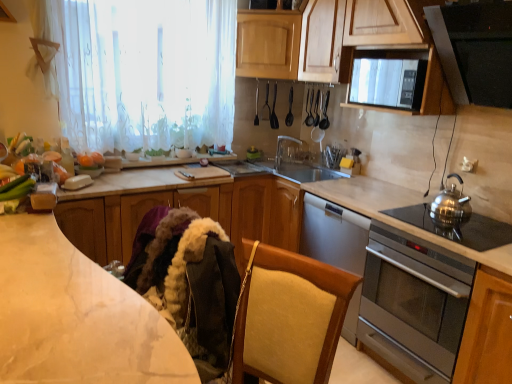
The width and height of the screenshot is (512, 384). What do you see at coordinates (487, 331) in the screenshot? I see `wooden cabinet at lower right, marked as the 4th cabinetry in a top-to-bottom arrangement` at bounding box center [487, 331].

Measure the distance between point (471, 352) and camera.

Point (471, 352) is 6.19 feet from camera.

What do you see at coordinates (413, 303) in the screenshot?
I see `stainless steel oven at right` at bounding box center [413, 303].

Identify the location of stainless steel oven at right. (413, 303).

The height and width of the screenshot is (384, 512). What do you see at coordinates (268, 44) in the screenshot? I see `wooden cabinet at upper center, the fourth cabinetry ordered from the bottom` at bounding box center [268, 44].

What do you see at coordinates (290, 42) in the screenshot? The height and width of the screenshot is (384, 512). I see `wooden cabinet at upper center, the second cabinetry when ordered from top to bottom` at bounding box center [290, 42].

Locate an element on the screen. This screenshot has height=384, width=512. wooden cabinet at lower right, the first cabinetry from the bottom is located at coordinates (487, 331).

Locate an element on the screen. The image size is (512, 384). the 2nd cabinetry behind the orange matte pumpkin at upper left, starting your count from the anchor is located at coordinates (268, 44).

How different are the orientations of wooden cabinet at upper center, arranged as the 1th cabinetry when viewed from the top, and orange matte pumpkin at upper left in degrees?

50.2 degrees.

Could you tell me if wooden cabinet at upper center, the fourth cabinetry ordered from the bottom, is turned towards orange matte pumpkin at upper left?

No, wooden cabinet at upper center, the fourth cabinetry ordered from the bottom, is not turned towards orange matte pumpkin at upper left.

Is wooden cabinet at upper center, the fourth cabinetry ordered from the bottom, next to orange matte pumpkin at upper left and touching it?

No.

The image size is (512, 384). Find the location of `chair that appears in front of the orange matte pumpkin at upper left`. chair that appears in front of the orange matte pumpkin at upper left is located at coordinates (288, 317).

Does velvet beige chair at lower center have a lesser height compared to orange matte pumpkin at upper left?

Incorrect, the height of velvet beige chair at lower center does not fall short of that of orange matte pumpkin at upper left.

Does velvet beige chair at lower center appear on the right side of orange matte pumpkin at upper left?

Yes, velvet beige chair at lower center is to the right of orange matte pumpkin at upper left.

Considering their positions, is velvet beige chair at lower center located in front of or behind orange matte pumpkin at upper left?

Clearly, velvet beige chair at lower center is in front of orange matte pumpkin at upper left.

Can you confirm if stainless steel oven at right is smaller than black plastic spoon at upper center, acting as the second appliance starting from the left?

No, stainless steel oven at right is not smaller than black plastic spoon at upper center, acting as the second appliance starting from the left.

Which point is more distant from viewer, (x=435, y=309) or (x=290, y=125)?

The point (x=290, y=125) is farther.

Is stainless steel oven at right positioned beyond the bounds of black plastic spoon at upper center, acting as the second appliance starting from the left?

That's correct, stainless steel oven at right is outside of black plastic spoon at upper center, acting as the second appliance starting from the left.

In the scene shown: Which object is further away from the camera taking this photo, stainless steel oven at right or black plastic spoon at upper center, which is counted as the 1th appliance, starting from the right?

black plastic spoon at upper center, which is counted as the 1th appliance, starting from the right, is behind.

From the image's perspective, who appears lower, metallic silver spoon at upper center, the 2th appliance from the right, or white sheer curtain at upper left?

metallic silver spoon at upper center, the 2th appliance from the right, appears lower in the image.

Can you confirm if metallic silver spoon at upper center, positioned as the 1th appliance in left-to-right order, is thinner than white sheer curtain at upper left?

Yes.

Is white sheer curtain at upper left positioned behind stainless steel kettle at right?

Yes, white sheer curtain at upper left is further from the camera.

Does white sheer curtain at upper left have a greater width compared to stainless steel kettle at right?

No, white sheer curtain at upper left is not wider than stainless steel kettle at right.

Is white sheer curtain at upper left situated inside stainless steel kettle at right or outside?

white sheer curtain at upper left is not inside stainless steel kettle at right, it's outside.

Considering the positions of point (202, 55) and point (455, 211), is point (202, 55) closer or farther from the camera than point (455, 211)?

Point (202, 55) is positioned farther from the camera compared to point (455, 211).

From the image's perspective, relative to clear plastic tap at center, is marble at left, marked as the first countertop in a front-to-back arrangement, above or below?

Based on their image positions, marble at left, marked as the first countertop in a front-to-back arrangement, is located beneath clear plastic tap at center.

Do you think marble at left, marked as the first countertop in a front-to-back arrangement, is within clear plastic tap at center, or outside of it?

marble at left, marked as the first countertop in a front-to-back arrangement, is located beyond the bounds of clear plastic tap at center.

Would you consider marble at left, marked as the first countertop in a front-to-back arrangement, to be distant from clear plastic tap at center?

Absolutely, marble at left, marked as the first countertop in a front-to-back arrangement, is distant from clear plastic tap at center.

Does marble at left, marked as the first countertop in a front-to-back arrangement, lie in front of clear plastic tap at center?

Yes, it is.

How many degrees apart are the facing directions of wooden cabinet at lower right, the first cabinetry from the bottom, and satin silver gas stove at right?

0.859 degrees.

Does point (479, 294) appear closer or farther from the camera than point (497, 239)?

Clearly, point (479, 294) is closer to the camera than point (497, 239).

Is wooden cabinet at lower right, the first cabinetry from the bottom, located outside satin silver gas stove at right?

Yes.

Does wooden cabinet at lower right, the first cabinetry from the bottom, come behind satin silver gas stove at right?

That is False.

Find the location of a particular element. the 1st cabinetry to the right of the orange matte pumpkin at upper left, counting from the anchor's position is located at coordinates (268, 44).

You are a GUI agent. You are given a task and a screenshot of the screen. Output one action in this format:
    pyautogui.click(x=<x>, y=<y>)
    Task: Click on the food above the velvet beige chair at lower center (from a real-world perspective)
    This screenshot has height=384, width=512.
    Given the screenshot: What is the action you would take?
    pyautogui.click(x=90, y=160)

Which object lies further to the anchor point clear plastic tap at center, marble at left, which is the second countertop in back-to-front order, or satin silver gas stove at right?

marble at left, which is the second countertop in back-to-front order, is further to clear plastic tap at center.

When comparing their distances from wooden cabinet at lower right, the first cabinetry from the bottom, does wooden cabinet at upper center, the second cabinetry when ordered from top to bottom, or metallic silver spoon at upper center, positioned as the 1th appliance in left-to-right order, seem further?

metallic silver spoon at upper center, positioned as the 1th appliance in left-to-right order, is further to wooden cabinet at lower right, the first cabinetry from the bottom.

Which object lies further to the anchor point metallic silver spoon at upper center, the 2th appliance from the right, orange matte pumpkin at upper left or wooden cabinet at upper center, arranged as the 1th cabinetry when viewed from the top?

Among the two, orange matte pumpkin at upper left is located further to metallic silver spoon at upper center, the 2th appliance from the right.

Looking at the image, which one is located further to clear plastic tap at center, wooden cabinet at upper center, the fourth cabinetry ordered from the bottom, or black plastic spoon at upper center, acting as the second appliance starting from the left?

The object further to clear plastic tap at center is wooden cabinet at upper center, the fourth cabinetry ordered from the bottom.

Looking at the image, which one is located closer to wooden cabinet at upper center, the fourth cabinetry ordered from the bottom, metallic silver spoon at upper center, positioned as the 1th appliance in left-to-right order, or white marble countertop at center, acting as the 1th countertop starting from the back?

metallic silver spoon at upper center, positioned as the 1th appliance in left-to-right order, is positioned closer to the anchor wooden cabinet at upper center, the fourth cabinetry ordered from the bottom.

Estimate the real-world distances between objects in this image. Which object is closer to stainless steel kettle at right, stainless steel oven at right or green matte cucumber at lower left?

stainless steel oven at right lies closer to stainless steel kettle at right than the other object.

Estimate the real-world distances between objects in this image. Which object is further from green matte cucumber at lower left, white sheer curtain at upper left or satin silver gas stove at right?

The object further to green matte cucumber at lower left is satin silver gas stove at right.

From the image, which object appears to be nearer to satin silver gas stove at right, white marble countertop at center, acting as the 1th countertop starting from the back, or stainless steel kettle at right?

stainless steel kettle at right is closer to satin silver gas stove at right.

This screenshot has height=384, width=512. Identify the location of countertop that lies between wooden cabinet at upper center, arranged as the 1th cabinetry when viewed from the top, and stainless steel oven at right from top to bottom. (243, 211).

Find the location of a particular element. The height and width of the screenshot is (384, 512). countertop located between marble at left, marked as the first countertop in a front-to-back arrangement, and satin silver gas stove at right in the left-right direction is located at coordinates (243, 211).

Identify the location of chair between wooden cabinet at upper center, the second cabinetry when ordered from top to bottom, and wooden cabinet at lower right, marked as the 4th cabinetry in a top-to-bottom arrangement, in the up-down direction. (288, 317).

Find the location of `countertop located between satin silver gas stove at right and metallic silver spoon at upper center, positioned as the 1th appliance in left-to-right order, in the depth direction`. countertop located between satin silver gas stove at right and metallic silver spoon at upper center, positioned as the 1th appliance in left-to-right order, in the depth direction is located at coordinates (243, 211).